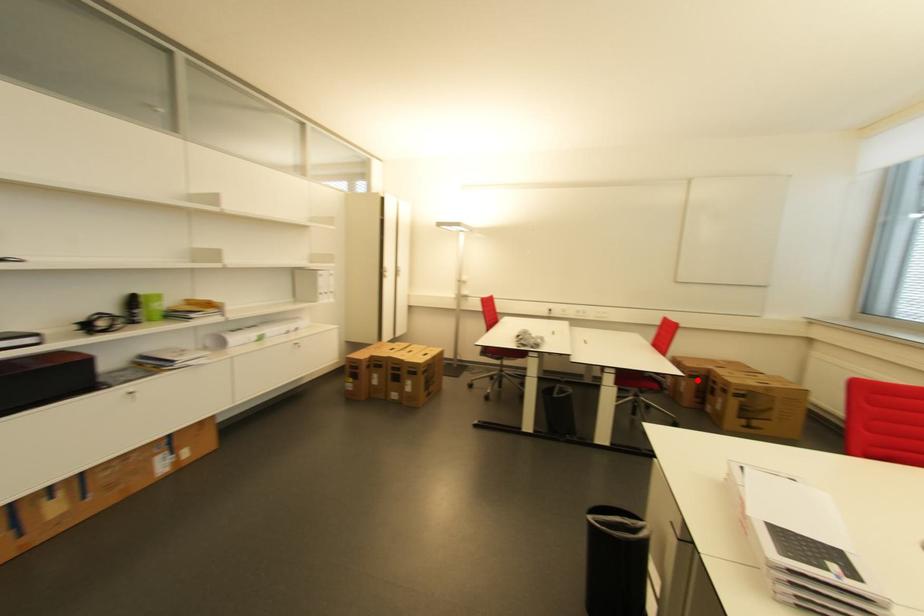
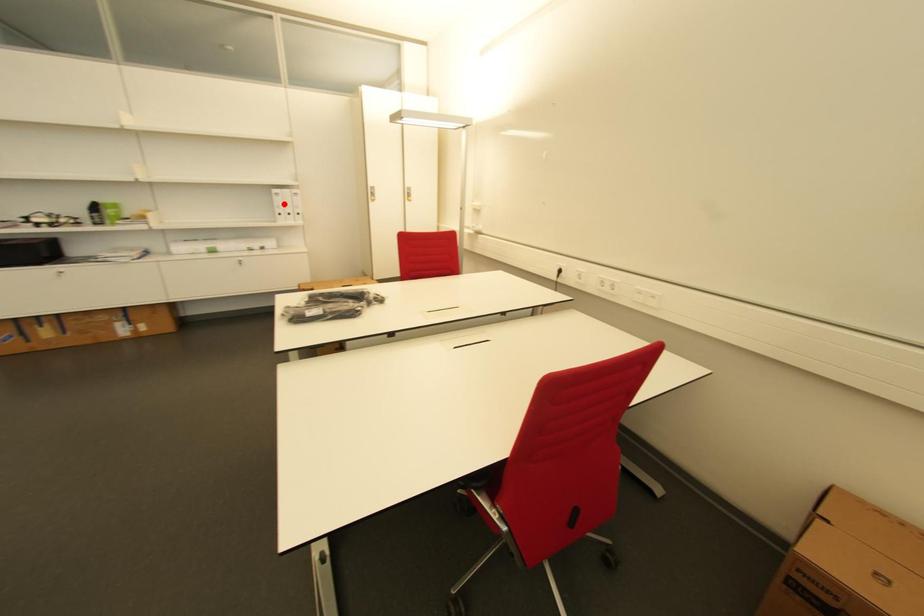
I am providing you with two images of the same scene from different viewpoints. A red point is marked on the first image and another point is marked on the second image. Does the point marked in image1 correspond to the same location as the one in image2?

No